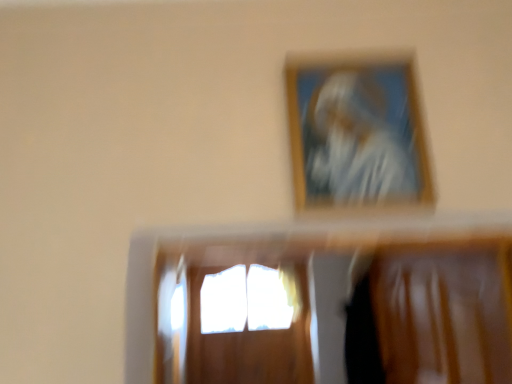
Question: Is translucent glass window at center surrounding wooden picture frame at upper center?

Choices:
 (A) no
 (B) yes

Answer: (A)

Question: Is translucent glass window at center bigger than wooden picture frame at upper center?

Choices:
 (A) no
 (B) yes

Answer: (B)

Question: Does translucent glass window at center come in front of wooden picture frame at upper center?

Choices:
 (A) no
 (B) yes

Answer: (A)

Question: Is translucent glass window at center further to the viewer compared to wooden picture frame at upper center?

Choices:
 (A) yes
 (B) no

Answer: (A)

Question: Considering the relative positions of translucent glass window at center and wooden picture frame at upper center in the image provided, is translucent glass window at center to the left of wooden picture frame at upper center from the viewer's perspective?

Choices:
 (A) yes
 (B) no

Answer: (A)

Question: Considering the relative sizes of translucent glass window at center and wooden picture frame at upper center in the image provided, is translucent glass window at center smaller than wooden picture frame at upper center?

Choices:
 (A) yes
 (B) no

Answer: (B)

Question: Is wooden picture frame at upper center to the right of translucent glass window at center from the viewer's perspective?

Choices:
 (A) yes
 (B) no

Answer: (A)

Question: Is translucent glass window at center a part of wooden picture frame at upper center?

Choices:
 (A) yes
 (B) no

Answer: (B)

Question: From the image's perspective, is wooden picture frame at upper center on top of translucent glass window at center?

Choices:
 (A) yes
 (B) no

Answer: (A)

Question: Does wooden picture frame at upper center have a lesser height compared to translucent glass window at center?

Choices:
 (A) no
 (B) yes

Answer: (B)

Question: From a real-world perspective, is wooden picture frame at upper center physically below translucent glass window at center?

Choices:
 (A) yes
 (B) no

Answer: (B)

Question: Is wooden picture frame at upper center at the left side of translucent glass window at center?

Choices:
 (A) yes
 (B) no

Answer: (B)

Question: Do you think translucent glass window at center is within wooden picture frame at upper center, or outside of it?

Choices:
 (A) outside
 (B) inside

Answer: (A)